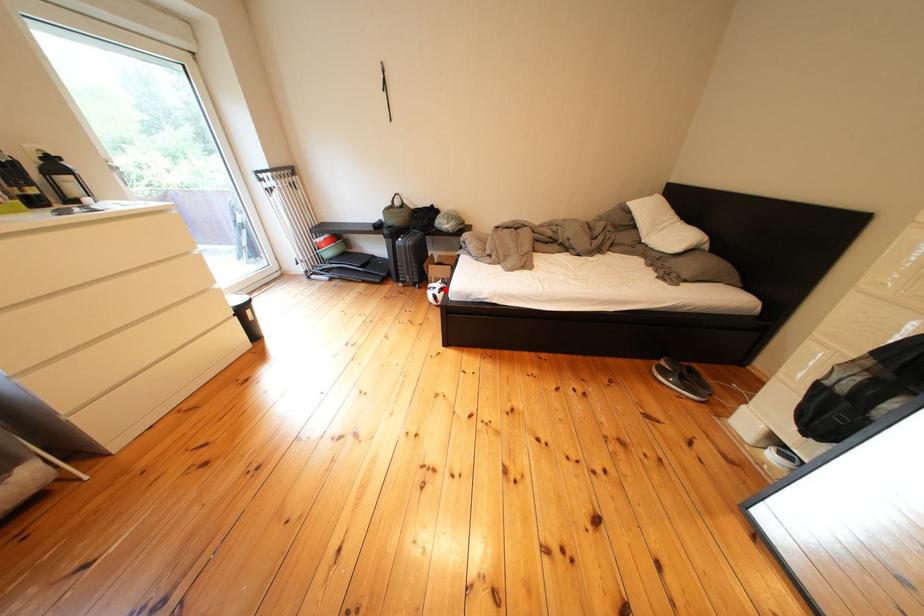
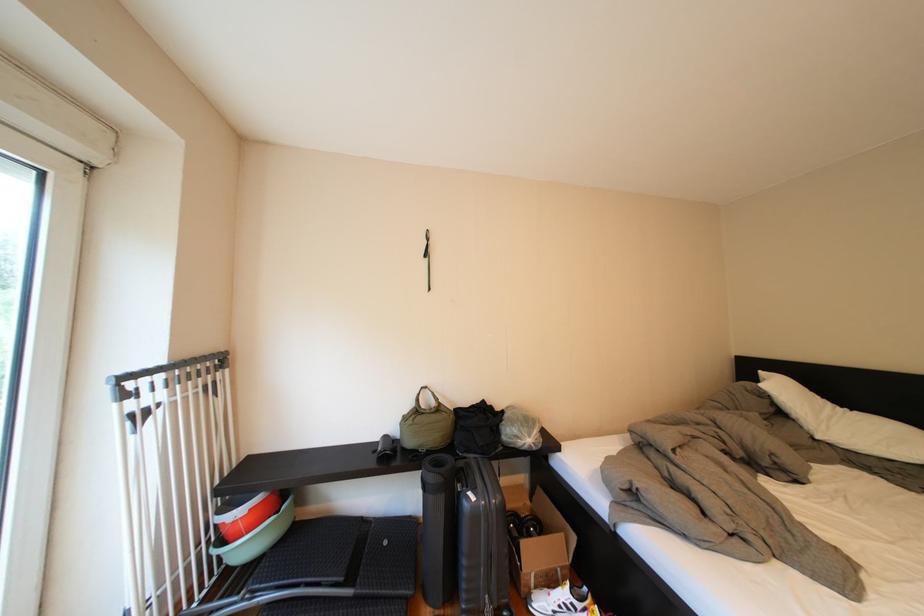
Where in the second image is the point corresponding to the highlighted location from the first image?

(554, 609)